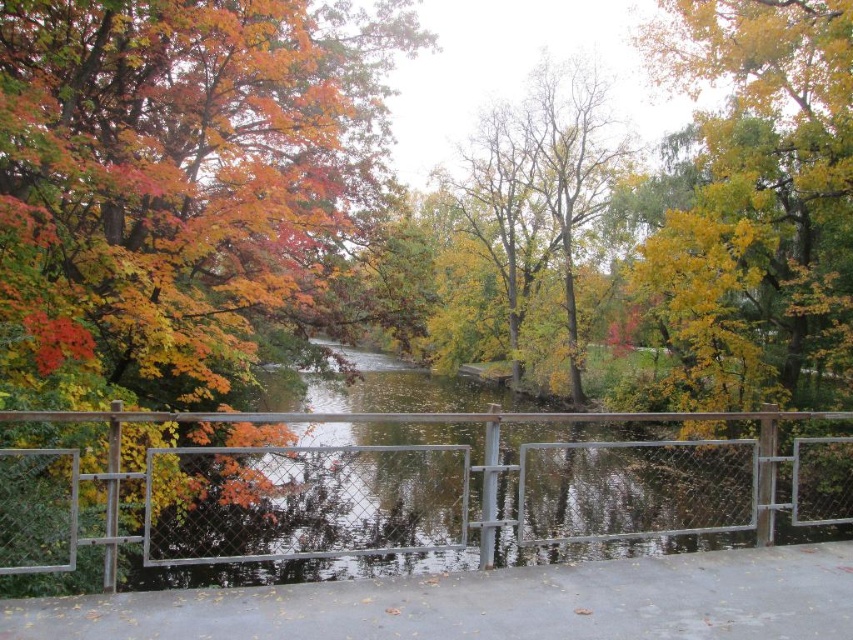
Question: Does metal chain-link fence at center appear on the left side of bare wood tree at center?

Choices:
 (A) no
 (B) yes

Answer: (B)

Question: Which point is farther to the camera?

Choices:
 (A) bare wood tree at center
 (B) metal chain-link fence at center

Answer: (A)

Question: Does metal chain-link fence at center have a larger size compared to bare wood tree at center?

Choices:
 (A) yes
 (B) no

Answer: (B)

Question: Does metal chain-link fence at center appear on the left side of bare wood tree at center?

Choices:
 (A) no
 (B) yes

Answer: (B)